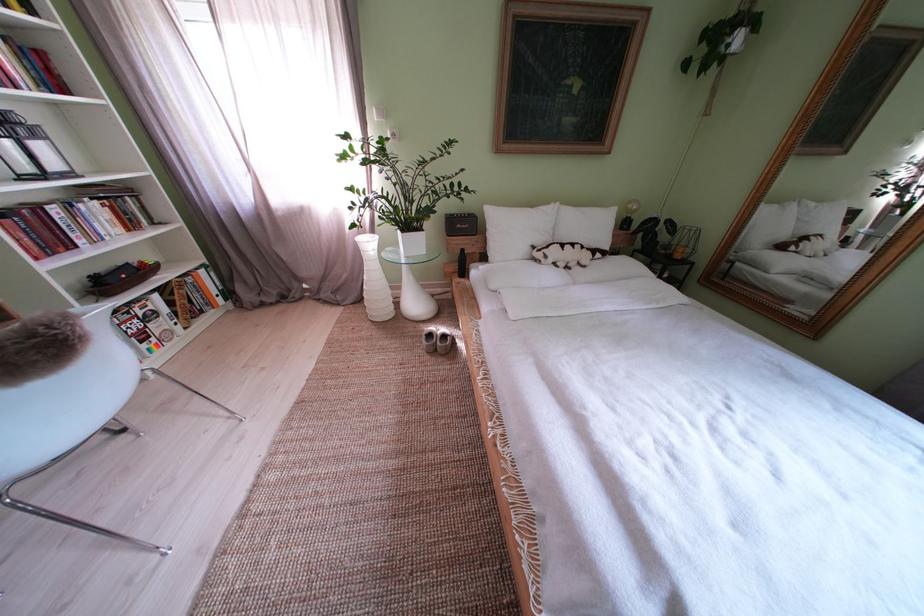
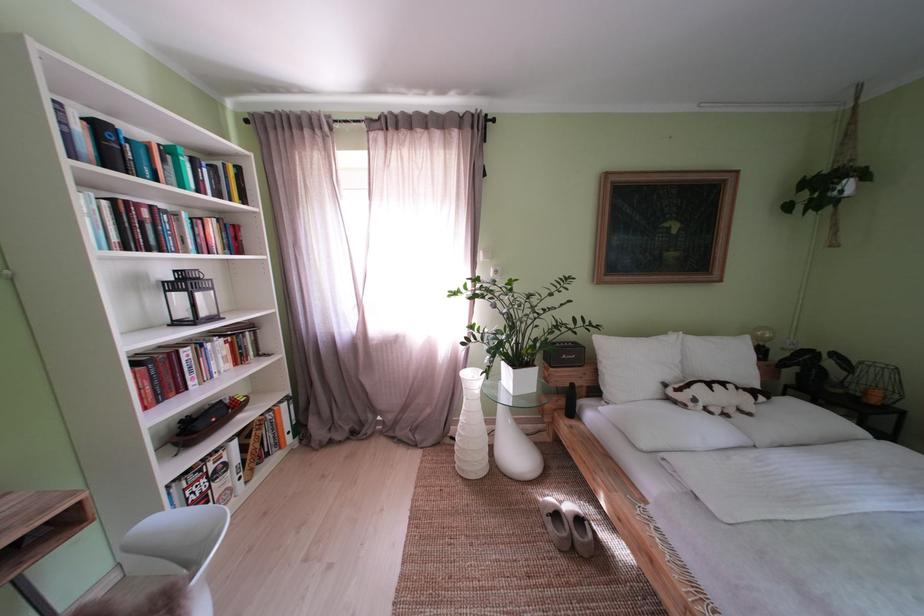
Find the pixel in the second image that matches point 556,262 in the first image.

(706, 406)